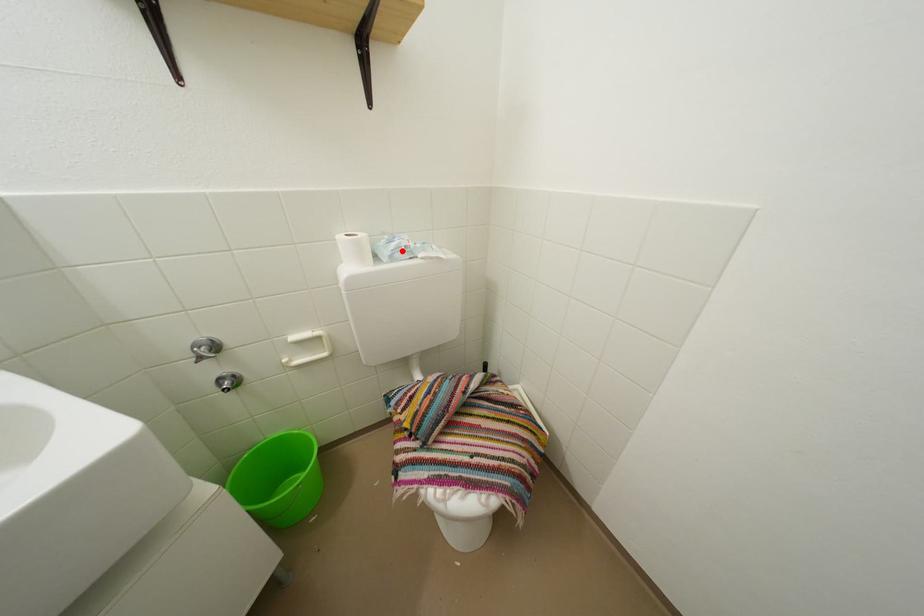
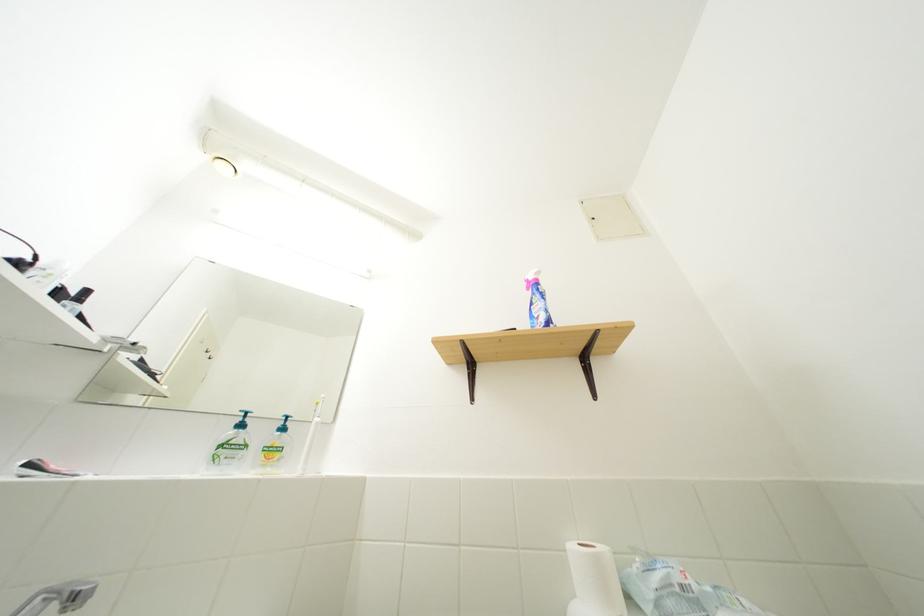
Where in the second image is the point corresponding to the highlighted location from the first image?

(665, 585)